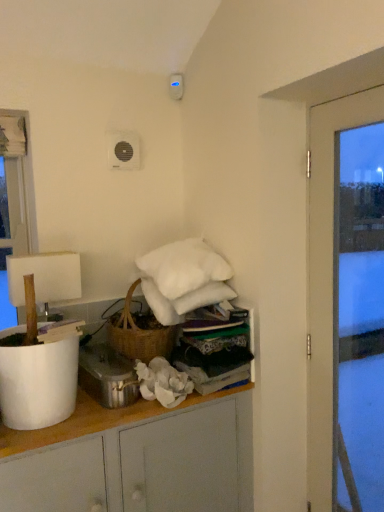
Question: Should I look upward or downward to see white matte lampshade at left?

Choices:
 (A) down
 (B) up

Answer: (A)

Question: Is white fabric at upper center far away from transparent glass door at right?

Choices:
 (A) yes
 (B) no

Answer: (B)

Question: Is white fabric at upper center not within transparent glass door at right?

Choices:
 (A) no
 (B) yes

Answer: (B)

Question: From a real-world perspective, is white fabric at upper center over transparent glass door at right?

Choices:
 (A) yes
 (B) no

Answer: (B)

Question: Is white fabric at upper center bigger than transparent glass door at right?

Choices:
 (A) yes
 (B) no

Answer: (B)

Question: Considering the relative positions of white fabric at upper center and transparent glass door at right in the image provided, is white fabric at upper center to the right of transparent glass door at right from the viewer's perspective?

Choices:
 (A) yes
 (B) no

Answer: (B)

Question: From the image's perspective, does white fabric at upper center appear higher than transparent glass door at right?

Choices:
 (A) yes
 (B) no

Answer: (B)

Question: Is white fabric at upper center to the left of metallic silver pot at lower center from the viewer's perspective?

Choices:
 (A) no
 (B) yes

Answer: (A)

Question: Could you tell me if white fabric at upper center is turned towards metallic silver pot at lower center?

Choices:
 (A) yes
 (B) no

Answer: (B)

Question: Considering the relative sizes of white fabric at upper center and metallic silver pot at lower center in the image provided, is white fabric at upper center wider than metallic silver pot at lower center?

Choices:
 (A) yes
 (B) no

Answer: (B)

Question: Considering the relative sizes of white fabric at upper center and metallic silver pot at lower center in the image provided, is white fabric at upper center thinner than metallic silver pot at lower center?

Choices:
 (A) no
 (B) yes

Answer: (B)

Question: Does white fabric at upper center have a smaller size compared to metallic silver pot at lower center?

Choices:
 (A) no
 (B) yes

Answer: (A)

Question: Is metallic silver pot at lower center located within white fabric at upper center?

Choices:
 (A) no
 (B) yes

Answer: (A)

Question: From a real-world perspective, is white fabric at upper center located beneath white matte lampshade at left?

Choices:
 (A) no
 (B) yes

Answer: (B)